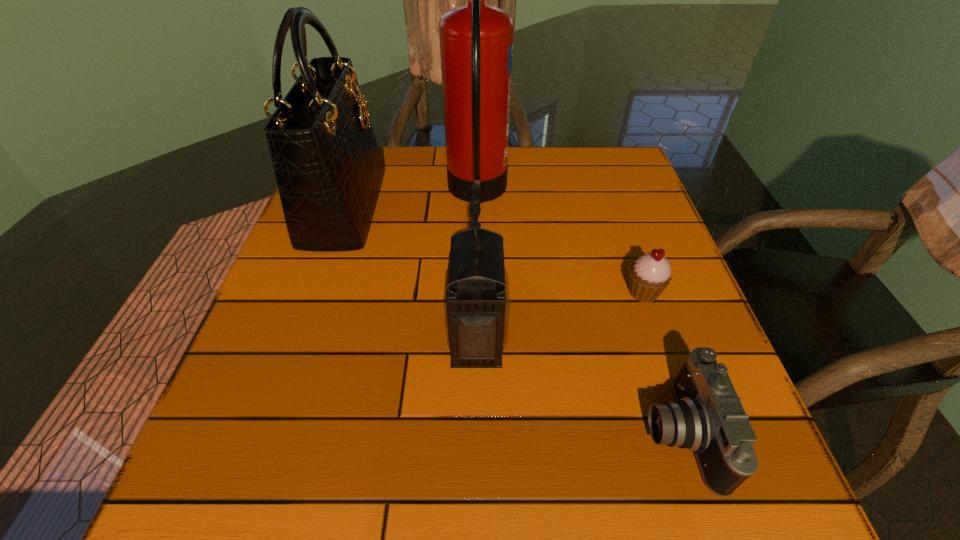
This screenshot has height=540, width=960. I want to click on vacant area that lies between the lantern and the cupcake, so click(x=560, y=316).

You are a GUI agent. You are given a task and a screenshot of the screen. Output one action in this format:
    pyautogui.click(x=<x>, y=<y>)
    Task: Click on the vacant point located between the cupcake and the fire extinguisher
    The width and height of the screenshot is (960, 540).
    Given the screenshot: What is the action you would take?
    pyautogui.click(x=561, y=242)

Locate an element on the screen. free area in between the fire extinguisher and the cupcake is located at coordinates (561, 242).

The height and width of the screenshot is (540, 960). Identify the location of empty location between the second tallest object and the fire extinguisher. (411, 200).

Where is `vacant area that lies between the nearest object and the fire extinguisher`? This screenshot has width=960, height=540. vacant area that lies between the nearest object and the fire extinguisher is located at coordinates (578, 313).

This screenshot has width=960, height=540. Identify the location of object that stands as the second closest to the third tallest object. [650, 274].

You are a GUI agent. You are given a task and a screenshot of the screen. Output one action in this format:
    pyautogui.click(x=<x>, y=<y>)
    Task: Click on the fourth closest object to the nearest object
    This screenshot has width=960, height=540.
    Given the screenshot: What is the action you would take?
    pyautogui.click(x=328, y=167)

I want to click on vacant space that satisfies the following two spatial constraints: 1. on the surface of the fire extinguisher; 2. on the left side of the third nearest object, so coord(476,292).

Identify the location of free region that satisfies the following two spatial constraints: 1. on the back side of the third nearest object; 2. on the surface of the fire extinguisher. click(609, 193).

At what (x,y) coordinates should I click in order to perform the action: click on free space that satisfies the following two spatial constraints: 1. on the front side of the cupcake; 2. on the front-facing side of the lantern. Please return your answer as a coordinate pair (x, y). Image resolution: width=960 pixels, height=540 pixels. Looking at the image, I should click on (660, 340).